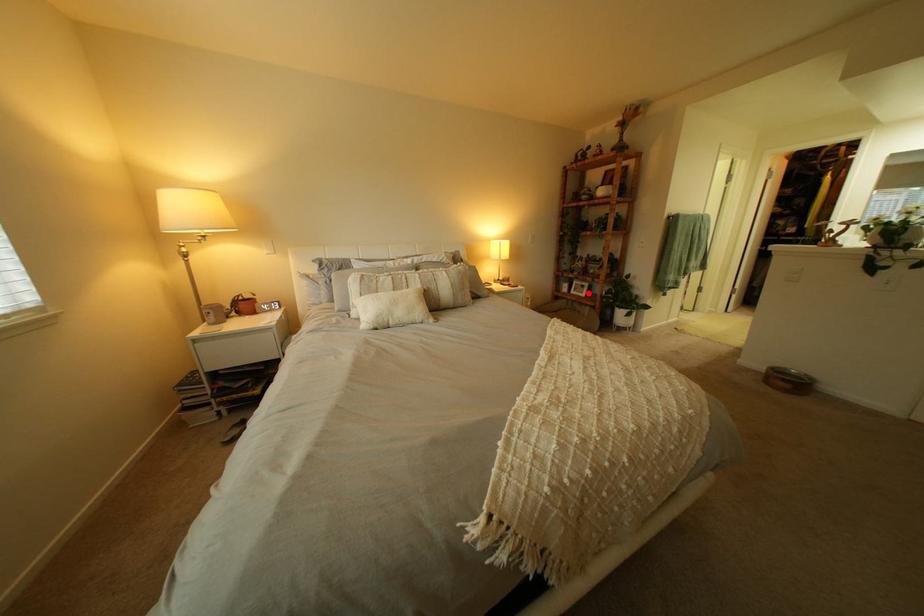
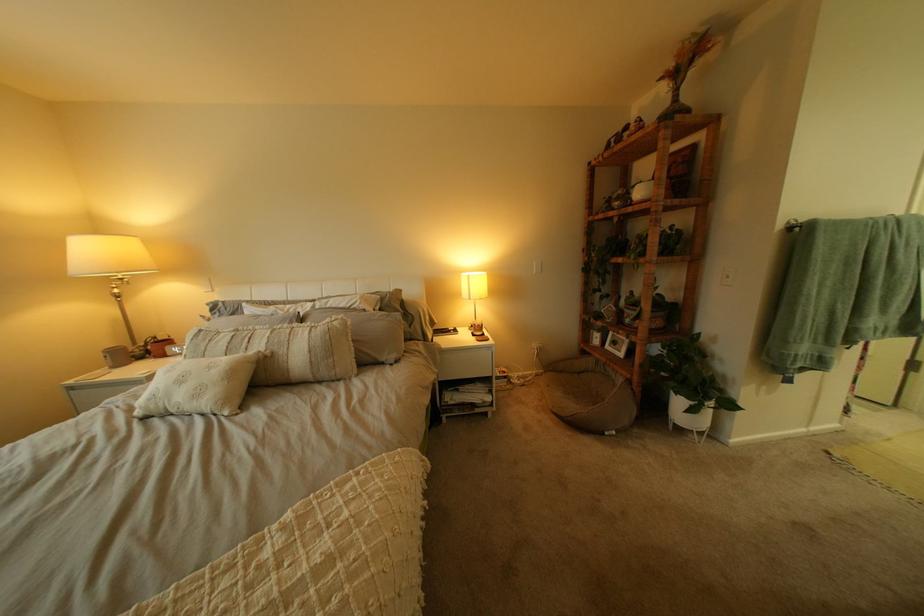
Question: I am providing you with two images of the same scene from different viewpoints. A red point is shown in image1. For the corresponding object point in image2, is it positioned nearer or farther from the camera?

Choices:
 (A) Nearer
 (B) Farther

Answer: (B)